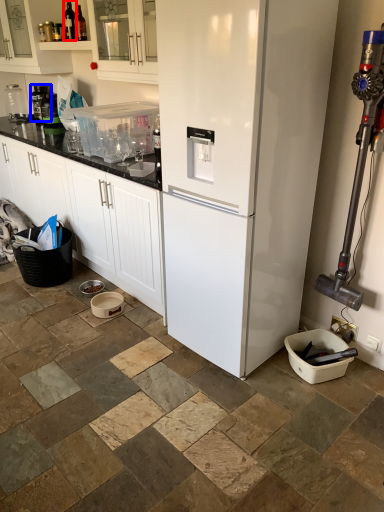
Question: Which object is further to the camera taking this photo, bottle (highlighted by a red box) or appliance (highlighted by a blue box)?

Choices:
 (A) bottle
 (B) appliance

Answer: (B)